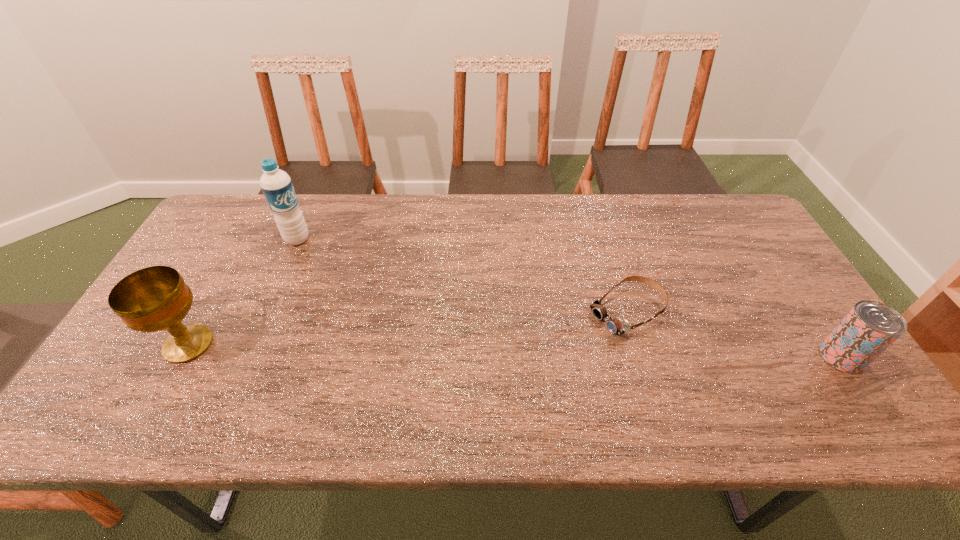
At what (x,y) coordinates should I click in order to perform the action: click on object at the right edge. Please return your answer as a coordinate pair (x, y). Image resolution: width=960 pixels, height=540 pixels. Looking at the image, I should click on (870, 327).

Find the location of a particular element. object at the near left corner is located at coordinates (156, 298).

Image resolution: width=960 pixels, height=540 pixels. I want to click on object that is at the near right corner, so click(870, 327).

Where is `free space at the far edge of the desktop`? This screenshot has width=960, height=540. free space at the far edge of the desktop is located at coordinates (348, 200).

Locate an element on the screen. vacant space at the near edge is located at coordinates (564, 368).

At what (x,y) coordinates should I click in order to perform the action: click on vacant space at the left edge of the desktop. Please return your answer as a coordinate pair (x, y). Looking at the image, I should click on (225, 255).

In the image, there is a desktop. At what (x,y) coordinates should I click in order to perform the action: click on blank space at the right edge. Please return your answer as a coordinate pair (x, y). This screenshot has width=960, height=540. Looking at the image, I should click on (806, 356).

The width and height of the screenshot is (960, 540). In order to click on free point at the far left corner in this screenshot , I will do `click(261, 218)`.

Find the location of a particular element. This screenshot has height=540, width=960. vacant area at the near left corner is located at coordinates (126, 381).

In order to click on free area in between the tallest object and the third object from left to right in this screenshot , I will do `click(462, 276)`.